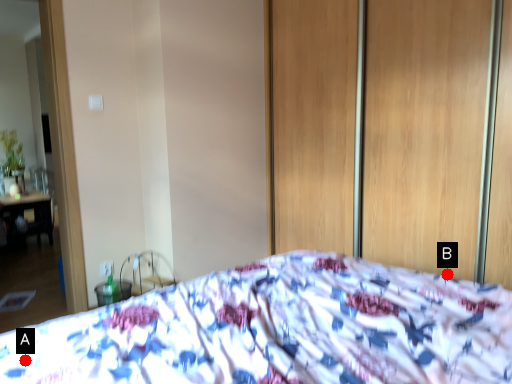
Question: Two points are circled on the image, labeled by A and B beside each circle. Which point is closer to the camera?

Choices:
 (A) A is closer
 (B) B is closer

Answer: (A)